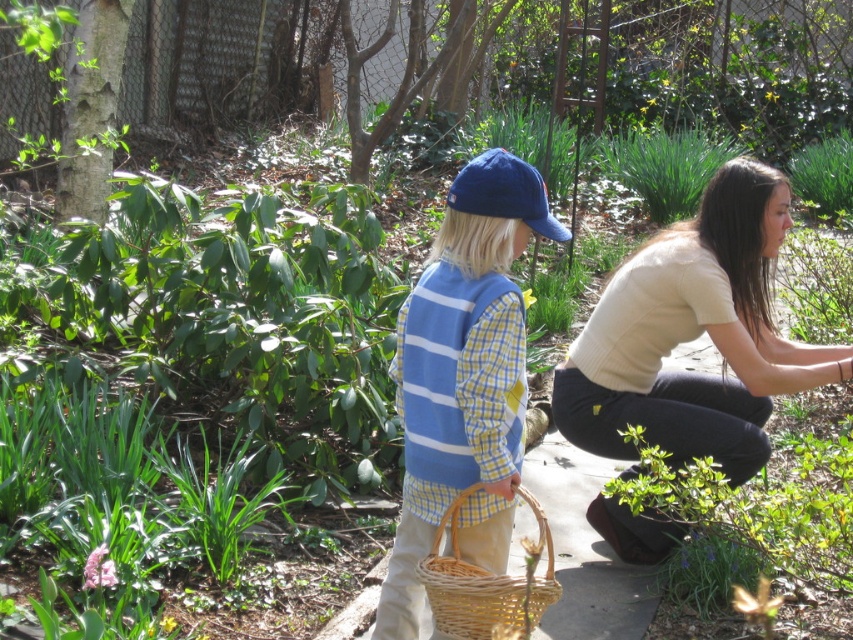
You are a photographer standing at the point marked as point (694, 336). You want to take a picture of the young child holding a wicker basket. Is the photographer located behind the child?

The point (694, 336) is on light beige sweater at lower right. Since the child is in the foreground, the photographer is behind the child, so yes, the photographer is located behind the child.

Consider the image. You are a parent trying to locate your child who is holding a wicker basket. You see the blue cotton cap at center and the light beige sweater at lower right. Which item is closer to the child?

The blue cotton cap at center is closer to the child since it is located at the center compared to the light beige sweater at lower right which is farther away.